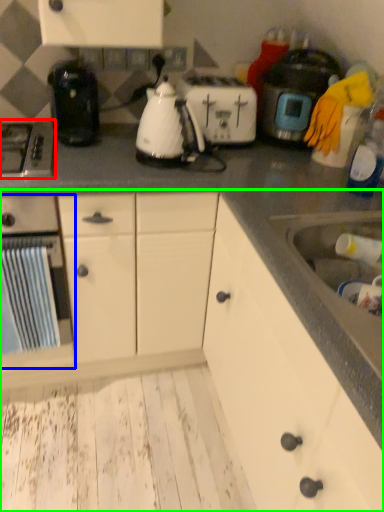
Question: Which object is positioned farthest from gas stove (highlighted by a red box)? Select from kitchen appliance (highlighted by a blue box) and cabinetry (highlighted by a green box).

Choices:
 (A) kitchen appliance
 (B) cabinetry

Answer: (B)